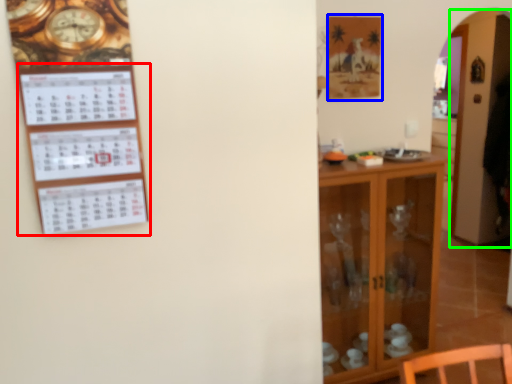
Question: Which is nearer to the bulletin board (highlighted by a red box)? picture frame (highlighted by a blue box) or glass door (highlighted by a green box).

Choices:
 (A) picture frame
 (B) glass door

Answer: (A)